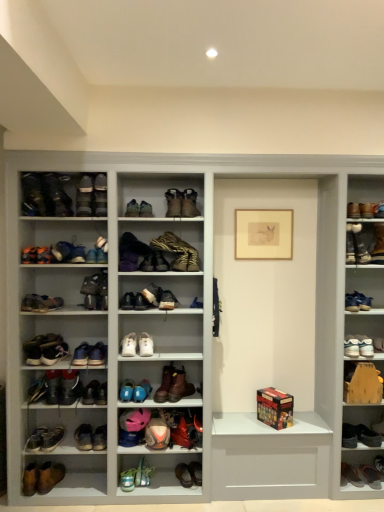
The width and height of the screenshot is (384, 512). Find the location of `vacant space in front of shiny teal sneakers at lower center, arranged as the 8th footwear when viewed from the left`. vacant space in front of shiny teal sneakers at lower center, arranged as the 8th footwear when viewed from the left is located at coordinates (129, 495).